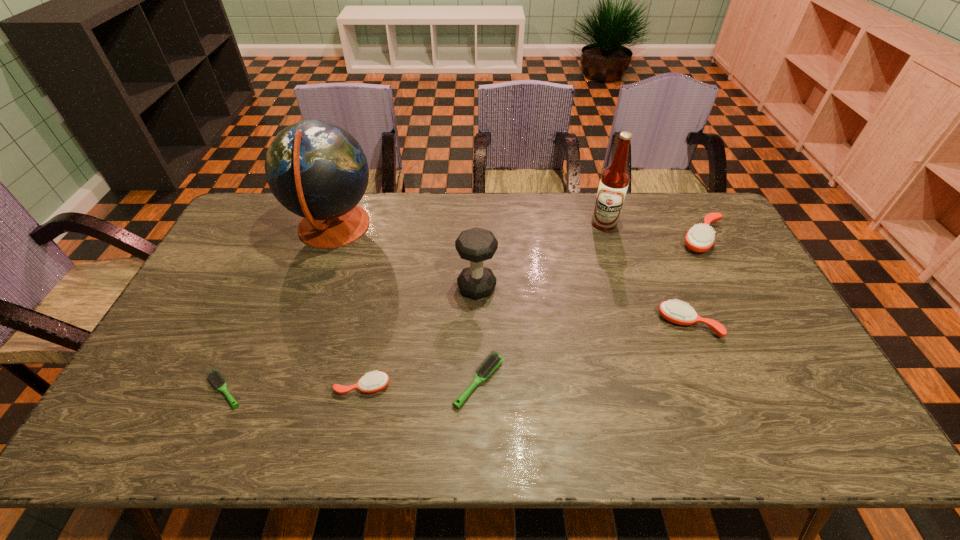
Where is `the leftmost orange hairbrush`? The height and width of the screenshot is (540, 960). the leftmost orange hairbrush is located at coordinates (372, 382).

Where is `the seventh tallest object`? The height and width of the screenshot is (540, 960). the seventh tallest object is located at coordinates (492, 362).

You are a GUI agent. You are given a task and a screenshot of the screen. Output one action in this format:
    pyautogui.click(x=<x>, y=<y>)
    Task: Click on the second shortest hairbrush
    
    Given the screenshot: What is the action you would take?
    pyautogui.click(x=492, y=362)

The image size is (960, 540). Find the location of `the leftmost hairbrush`. the leftmost hairbrush is located at coordinates (214, 376).

Image resolution: width=960 pixels, height=540 pixels. I want to click on the shortest hairbrush, so coord(214,376).

At what (x,y) coordinates should I click in order to perform the action: click on free location located with the Americas facing the viewer on the globe. Please return your answer as a coordinate pair (x, y). Looking at the image, I should click on (407, 227).

I want to click on free space located 0.380m on the label side of the red alcohol, so click(x=633, y=318).

Where is `free space located on the front of the fourth farthest object`? The width and height of the screenshot is (960, 540). free space located on the front of the fourth farthest object is located at coordinates (476, 428).

Identify the location of vacant space located on the left of the tallest hairbrush. This screenshot has height=540, width=960. (584, 239).

At what (x,y) coordinates should I click in order to perform the action: click on vacant position located 0.190m on the right of the second farthest hairbrush. Please return your answer as a coordinate pair (x, y). This screenshot has height=540, width=960. Looking at the image, I should click on (783, 324).